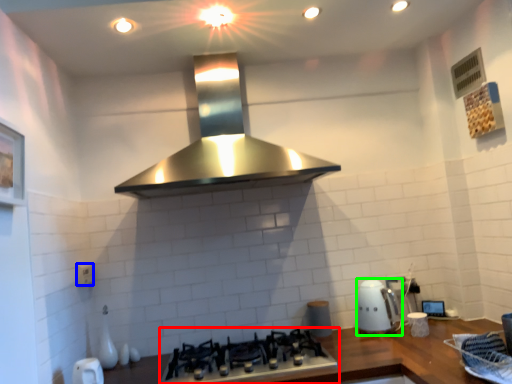
Question: Considering the real-world distances, which object is closest to gas stove (highlighted by a red box)? electric outlet (highlighted by a blue box) or kitchen appliance (highlighted by a green box).

Choices:
 (A) electric outlet
 (B) kitchen appliance

Answer: (B)